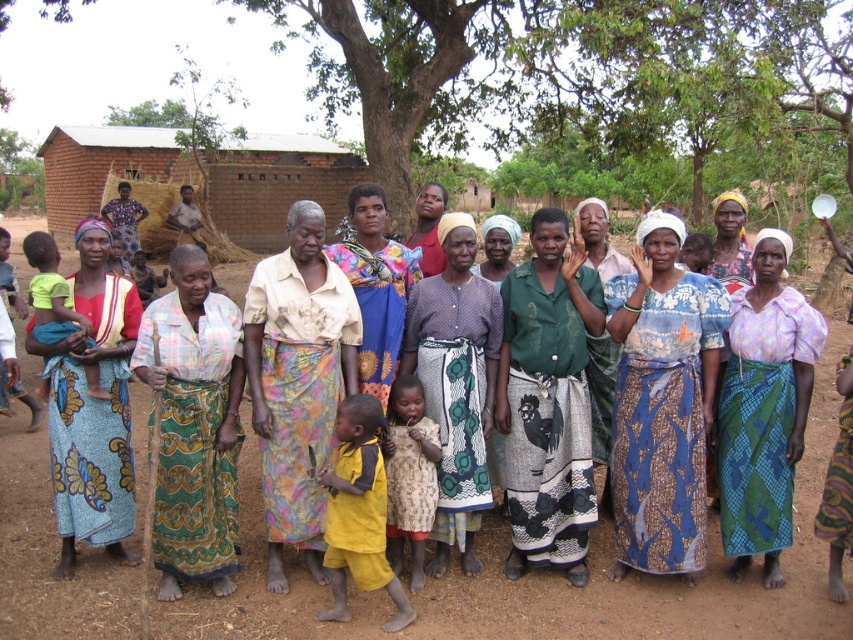
Question: Is green leafy tree at upper center below printed cotton dress at center?

Choices:
 (A) yes
 (B) no

Answer: (B)

Question: Does printed cotton dress at center appear on the right side of yellow cotton dress at center?

Choices:
 (A) yes
 (B) no

Answer: (B)

Question: Which object is the farthest from the blue printed fabric at center?

Choices:
 (A) printed cotton dress at center
 (B) green printed skirt at center
 (C) dull yellow dress at center

Answer: (A)

Question: Among these points, which one is nearest to the camera?

Choices:
 (A) (235, 561)
 (B) (625, 272)
 (C) (376, 339)
 (D) (440, 132)

Answer: (A)

Question: Which point appears closest to the camera in this image?

Choices:
 (A) (312, 524)
 (B) (393, 499)
 (C) (602, 211)

Answer: (A)

Question: Does printed fabric skirt at center have a lesser width compared to matte green dress at center?

Choices:
 (A) no
 (B) yes

Answer: (A)